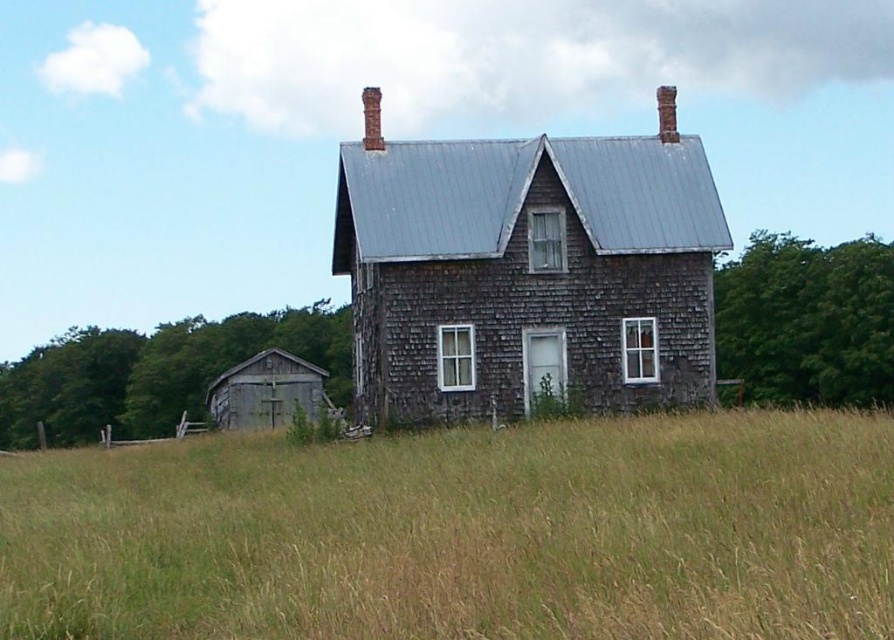
You are standing in front of the rustic wooden house and notice a brown grassy field at center and a weathered wood barn at lower left. Which object is positioned to the right of the other?

The brown grassy field at center is to the right of the weathered wood barn at lower left.

You are a delivery person trying to park your van between the weathered wood barn at center and the weathered wood barn at lower left. The van is 6 meters long. Can you fit it there?

The distance between the weathered wood barn at center and the weathered wood barn at lower left is 7.86 meters. Since the van is 6 meters long, there is enough space to park it between them.

You are a photographer planning to take a photo of the weathered wood barn at center and the weathered wood barn at lower left. Which barn should you focus on first if you want to capture the larger one in your shot?

The weathered wood barn at center is bigger than the weathered wood barn at lower left, so you should focus on the weathered wood barn at center first to capture the larger one in your shot.